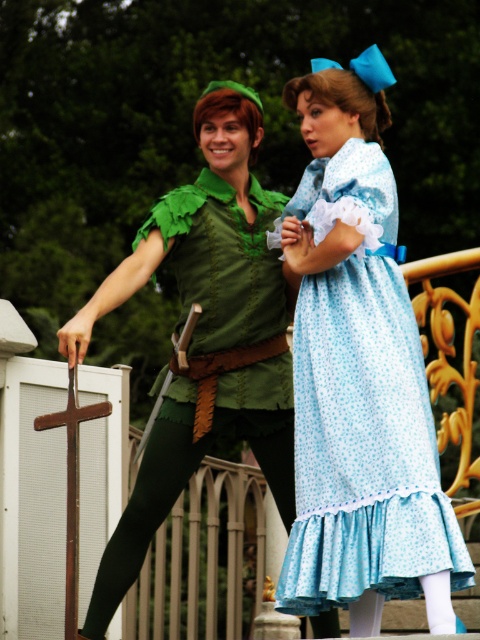
Does light blue floral fabric dress at right have a greater width compared to light blue floral dress at center?

In fact, light blue floral fabric dress at right might be narrower than light blue floral dress at center.

Measure the distance between light blue floral fabric dress at right and camera.

227.31 feet

In order to click on light blue floral fabric dress at right in this screenshot , I will do `click(362, 444)`.

Is light blue floral dress at center bigger than green felt tights at lower left?

Yes, light blue floral dress at center is bigger than green felt tights at lower left.

Is light blue floral dress at center thinner than green felt tights at lower left?

No, light blue floral dress at center is not thinner than green felt tights at lower left.

Describe the element at coordinates (204, 333) in the screenshot. I see `light blue floral dress at center` at that location.

This screenshot has height=640, width=480. What are the coordinates of `light blue floral dress at center` in the screenshot? It's located at (204, 333).

Describe the element at coordinates (362, 444) in the screenshot. I see `light blue floral fabric dress at right` at that location.

Is light blue floral fabric dress at right to the left of green felt tights at lower left from the viewer's perspective?

Incorrect, light blue floral fabric dress at right is not on the left side of green felt tights at lower left.

Who is more distant from viewer, (362, 497) or (119, 529)?

Positioned behind is point (119, 529).

Locate an element on the screen. The image size is (480, 640). light blue floral fabric dress at right is located at coordinates (362, 444).